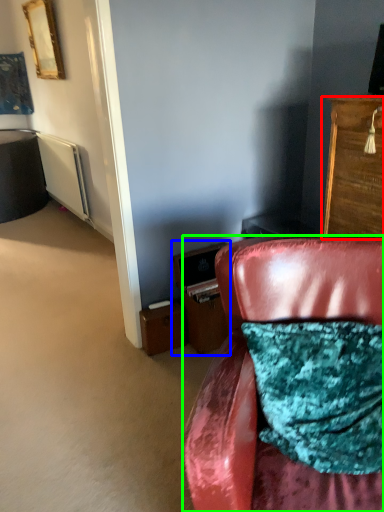
Question: Based on their relative distances, which object is farther from cabinetry (highlighted by a red box)? Choose from file cabinet (highlighted by a blue box) and chair (highlighted by a green box).

Choices:
 (A) file cabinet
 (B) chair

Answer: (A)